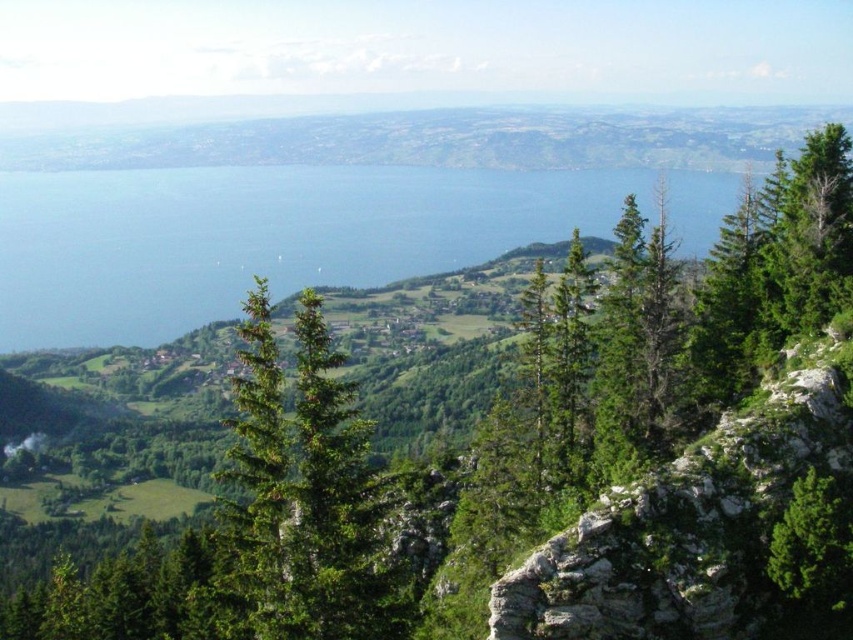
Question: Which point is farther to the camera?

Choices:
 (A) blue water at center
 (B) green textured tree at right

Answer: (A)

Question: Where is blue water at center located in relation to green textured tree at right in the image?

Choices:
 (A) right
 (B) left

Answer: (B)

Question: Which point is closer to the camera?

Choices:
 (A) blue water at center
 (B) green textured tree at right

Answer: (B)

Question: Which point is closer to the camera taking this photo?

Choices:
 (A) (837, 564)
 (B) (405, 177)

Answer: (A)

Question: Where is blue water at center located in relation to green textured tree at right in the image?

Choices:
 (A) right
 (B) left

Answer: (B)

Question: From the image, what is the correct spatial relationship of blue water at center in relation to green textured tree at right?

Choices:
 (A) right
 (B) left

Answer: (B)